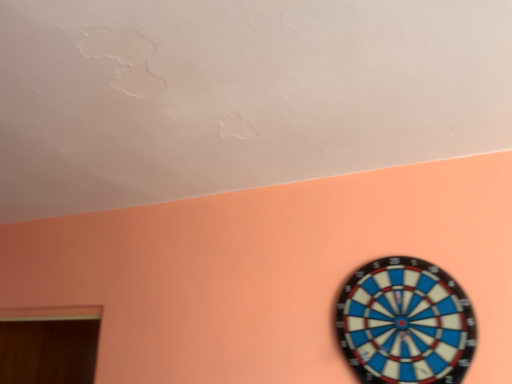
Locate an element on the screen. The height and width of the screenshot is (384, 512). wooden door at lower left is located at coordinates 49,344.

This screenshot has width=512, height=384. What do you see at coordinates (49, 344) in the screenshot?
I see `wooden door at lower left` at bounding box center [49, 344].

You are a GUI agent. You are given a task and a screenshot of the screen. Output one action in this format:
    pyautogui.click(x=<x>, y=<y>)
    Task: Click on the blue plastic dartboard at lower right
    This screenshot has width=512, height=384.
    Given the screenshot: What is the action you would take?
    [405, 323]

Describe the element at coordinates (405, 323) in the screenshot. I see `blue plastic dartboard at lower right` at that location.

At what (x,y) coordinates should I click in order to perform the action: click on wooden door at lower left. Please return your answer as a coordinate pair (x, y). Looking at the image, I should click on (49, 344).

Does blue plastic dartboard at lower right appear on the right side of wooden door at lower left?

Indeed, blue plastic dartboard at lower right is positioned on the right side of wooden door at lower left.

Considering the positions of objects blue plastic dartboard at lower right and wooden door at lower left in the image provided, who is behind, blue plastic dartboard at lower right or wooden door at lower left?

wooden door at lower left is more distant.

Which is less distant, (352,338) or (20,349)?

Point (352,338).

From the image's perspective, relative to wooden door at lower left, is blue plastic dartboard at lower right above or below?

Clearly, from the image's perspective, blue plastic dartboard at lower right is above wooden door at lower left.

From a real-world perspective, is blue plastic dartboard at lower right located beneath wooden door at lower left?

No, from a real-world perspective, blue plastic dartboard at lower right is not under wooden door at lower left.

Is blue plastic dartboard at lower right wider or thinner than wooden door at lower left?

Considering their sizes, blue plastic dartboard at lower right looks slimmer than wooden door at lower left.

Which of these two, blue plastic dartboard at lower right or wooden door at lower left, stands taller?

With more height is wooden door at lower left.

From the picture: Can you confirm if blue plastic dartboard at lower right is bigger than wooden door at lower left?

No, blue plastic dartboard at lower right is not bigger than wooden door at lower left.

Is wooden door at lower left surrounded by blue plastic dartboard at lower right?

No, wooden door at lower left is not inside blue plastic dartboard at lower right.

Is blue plastic dartboard at lower right next to wooden door at lower left and touching it?

No, blue plastic dartboard at lower right is not next to wooden door at lower left.

Is blue plastic dartboard at lower right turned away from wooden door at lower left?

blue plastic dartboard at lower right is not turned away from wooden door at lower left.

Based on the photo, what's the angular difference between blue plastic dartboard at lower right and wooden door at lower left's facing directions?

blue plastic dartboard at lower right and wooden door at lower left are facing 91 degrees away from each other.

Locate an element on the screen. clock lying on the right of wooden door at lower left is located at coordinates (405, 323).

Considering the positions of objects wooden door at lower left and blue plastic dartboard at lower right in the image provided, who is more to the right, wooden door at lower left or blue plastic dartboard at lower right?

blue plastic dartboard at lower right is more to the right.

Considering their positions, is wooden door at lower left located in front of or behind blue plastic dartboard at lower right?

In the image, wooden door at lower left appears behind blue plastic dartboard at lower right.

Is point (81, 375) closer to camera compared to point (433, 289)?

No, (81, 375) is behind (433, 289).

From the image's perspective, is wooden door at lower left located beneath blue plastic dartboard at lower right?

Correct, wooden door at lower left appears lower than blue plastic dartboard at lower right in the image.

From a real-world perspective, is wooden door at lower left physically located above or below blue plastic dartboard at lower right?

From a real-world perspective, wooden door at lower left is physically below blue plastic dartboard at lower right.

Can you confirm if wooden door at lower left is thinner than blue plastic dartboard at lower right?

Incorrect, the width of wooden door at lower left is not less than that of blue plastic dartboard at lower right.

Which of these two, wooden door at lower left or blue plastic dartboard at lower right, stands taller?

With more height is wooden door at lower left.

Considering the sizes of objects wooden door at lower left and blue plastic dartboard at lower right in the image provided, who is bigger, wooden door at lower left or blue plastic dartboard at lower right?

wooden door at lower left.

Is wooden door at lower left surrounding blue plastic dartboard at lower right?

No, blue plastic dartboard at lower right is not a part of wooden door at lower left.

Is the surface of wooden door at lower left in direct contact with blue plastic dartboard at lower right?

No.

Could you tell me if wooden door at lower left is turned towards blue plastic dartboard at lower right?

Yes.

Consider the image. How far apart are wooden door at lower left and blue plastic dartboard at lower right?

wooden door at lower left and blue plastic dartboard at lower right are 2.14 meters apart.

The width and height of the screenshot is (512, 384). Find the location of `clock above the wooden door at lower left (from a real-world perspective)`. clock above the wooden door at lower left (from a real-world perspective) is located at coordinates (405, 323).

Image resolution: width=512 pixels, height=384 pixels. Find the location of `clock that is above the wooden door at lower left (from the image's perspective)`. clock that is above the wooden door at lower left (from the image's perspective) is located at coordinates (405, 323).

Find the location of a particular element. The height and width of the screenshot is (384, 512). clock in front of the wooden door at lower left is located at coordinates (405, 323).